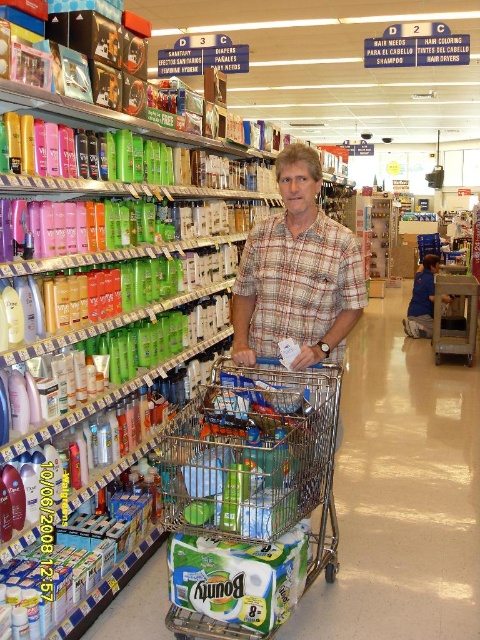
Between metallic silver trolley at center and metallic silver shopping cart at center, which one has more height?

metallic silver shopping cart at center

Can you confirm if metallic silver trolley at center is taller than metallic silver shopping cart at center?

No.

Who is more distant from viewer, (324, 448) or (447, 340)?

The point (447, 340) is more distant.

You are a GUI agent. You are given a task and a screenshot of the screen. Output one action in this format:
    pyautogui.click(x=<x>, y=<y>)
    Task: Click on the metallic silver trolley at center
    The width and height of the screenshot is (480, 640).
    Given the screenshot: What is the action you would take?
    tap(255, 458)

Who is taller, metallic silver trolley at center or plaid cotton shirt at center?

plaid cotton shirt at center

Does metallic silver trolley at center have a lesser height compared to plaid cotton shirt at center?

Yes, metallic silver trolley at center is shorter than plaid cotton shirt at center.

Locate an element on the screen. The width and height of the screenshot is (480, 640). metallic silver trolley at center is located at coordinates (255, 458).

Does metallic silver shopping cart at center have a smaller size compared to plaid cotton shirt at center?

Correct, metallic silver shopping cart at center occupies less space than plaid cotton shirt at center.

Which is in front, point (465, 339) or point (421, 276)?

Point (465, 339)

Image resolution: width=480 pixels, height=640 pixels. Describe the element at coordinates (455, 317) in the screenshot. I see `metallic silver shopping cart at center` at that location.

Locate an element on the screen. metallic silver shopping cart at center is located at coordinates (455, 317).